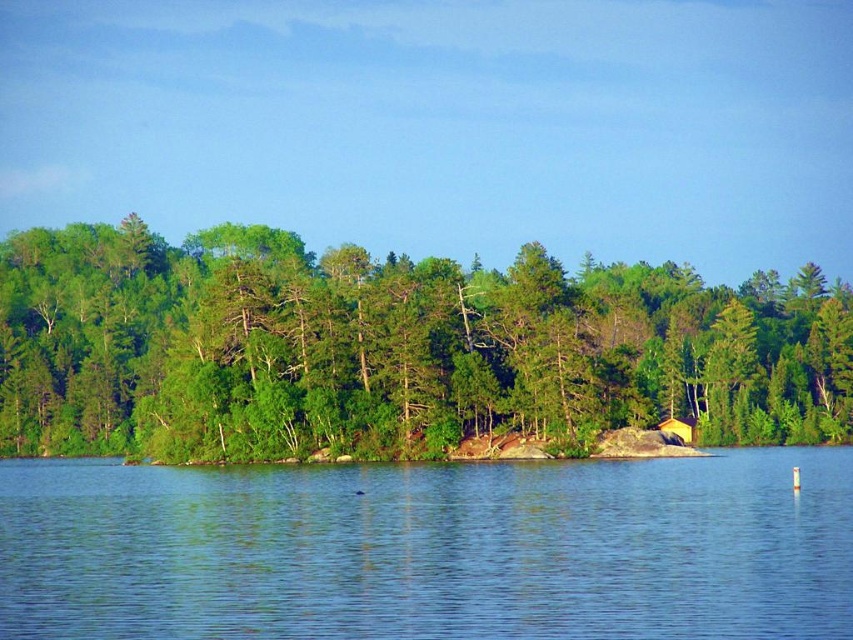
You are standing at the edge of the forest looking at two points in the image, point (451, 280) and point (689, 444). Which point is nearer to you?

Point (451, 280) is closer to the camera than point (689, 444), so it is nearer to you.

Based on the scene description and the coordinates provided, what does the point at coordinates (430, 548) indicate?

The point at coordinates (430, 548) marks clear blue water at center.